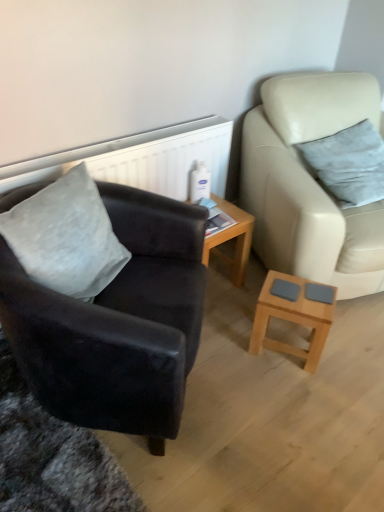
Question: Is leather studio couch at right at the right side of light brown wooden coffee table at lower right?

Choices:
 (A) yes
 (B) no

Answer: (A)

Question: Considering the relative positions of leather studio couch at right and light brown wooden coffee table at lower right in the image provided, is leather studio couch at right behind light brown wooden coffee table at lower right?

Choices:
 (A) no
 (B) yes

Answer: (A)

Question: Is light brown wooden coffee table at lower right surrounded by leather studio couch at right?

Choices:
 (A) no
 (B) yes

Answer: (A)

Question: Can you confirm if leather studio couch at right is taller than light brown wooden coffee table at lower right?

Choices:
 (A) no
 (B) yes

Answer: (B)

Question: Could you tell me if leather studio couch at right is facing light brown wooden coffee table at lower right?

Choices:
 (A) no
 (B) yes

Answer: (A)

Question: Does point (327, 129) appear closer or farther from the camera than point (251, 215)?

Choices:
 (A) farther
 (B) closer

Answer: (B)

Question: From the image's perspective, is leather studio couch at right above or below wooden table at center?

Choices:
 (A) below
 (B) above

Answer: (B)

Question: Do you think leather studio couch at right is within wooden table at center, or outside of it?

Choices:
 (A) inside
 (B) outside

Answer: (B)

Question: In the image, is leather studio couch at right positioned in front of or behind wooden table at center?

Choices:
 (A) front
 (B) behind

Answer: (A)

Question: From the image's perspective, is suede black armchair at left above or below velvety gray pillow at right, positioned as the 1th pillow in right-to-left order?

Choices:
 (A) below
 (B) above

Answer: (A)

Question: Based on their positions, is suede black armchair at left located to the left or right of velvety gray pillow at right, the 2th pillow from the front?

Choices:
 (A) right
 (B) left

Answer: (B)

Question: Considering the positions of suede black armchair at left and velvety gray pillow at right, the 2th pillow from the front, in the image, is suede black armchair at left wider or thinner than velvety gray pillow at right, the 2th pillow from the front,?

Choices:
 (A) wide
 (B) thin

Answer: (A)

Question: Would you say suede black armchair at left is inside or outside velvety gray pillow at right, which is the second pillow in left-to-right order?

Choices:
 (A) outside
 (B) inside

Answer: (A)

Question: In the image, is wooden table at center on the left side or the right side of gray velvety pillow at left, arranged as the 1th pillow when viewed from the front?

Choices:
 (A) right
 (B) left

Answer: (A)

Question: Do you think wooden table at center is within gray velvety pillow at left, the first pillow viewed from the left, or outside of it?

Choices:
 (A) inside
 (B) outside

Answer: (B)